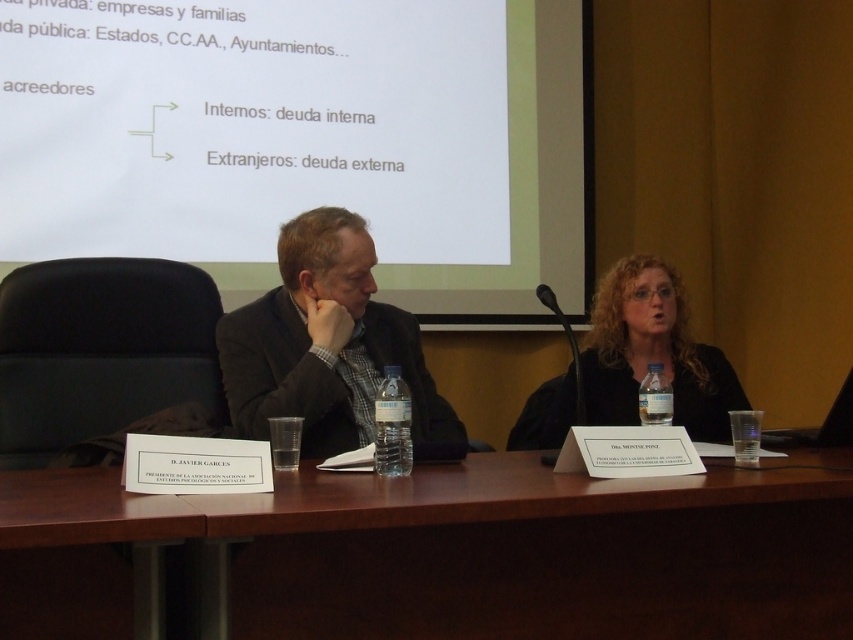
From the picture: You are an event organizer arranging seating for a panel discussion. You have two items to place on the table between the two participants. The items are a tall matte black suit at center and a shorter matte black jacket at center. Which item should you place closer to the woman on the right to avoid blocking her microphone?

The matte black jacket at center is shorter than the matte black suit at center, so placing the shorter matte black jacket at center closer to the woman on the right would be less likely to block her microphone.

You are an event organizer setting up a presentation room. You need to ensure that the white matte projector screen at upper center is visible to all attendees. Considering the height of the matte black suit at center, is the projector screen tall enough to be seen over the seated individuals?

The white matte projector screen at upper center has a greater height compared to the matte black suit at center, so yes, the projector screen is tall enough to be seen over the seated individuals.

You are organizing a small event and need to place a decorative centerpiece on the brown wood table at center. Considering the size of the matte black suit at center, will the table have enough space for the centerpiece?

The brown wood table at center is bigger than the matte black suit at center, so there should be sufficient space to place a decorative centerpiece on the table.